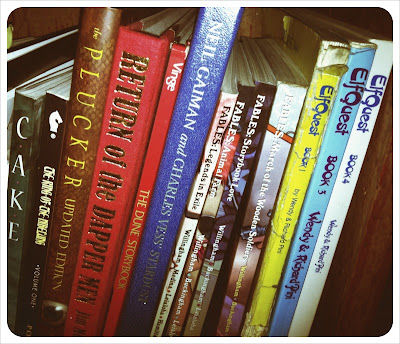
Locate an element on the screen. This screenshot has width=400, height=344. book is located at coordinates (82, 116).